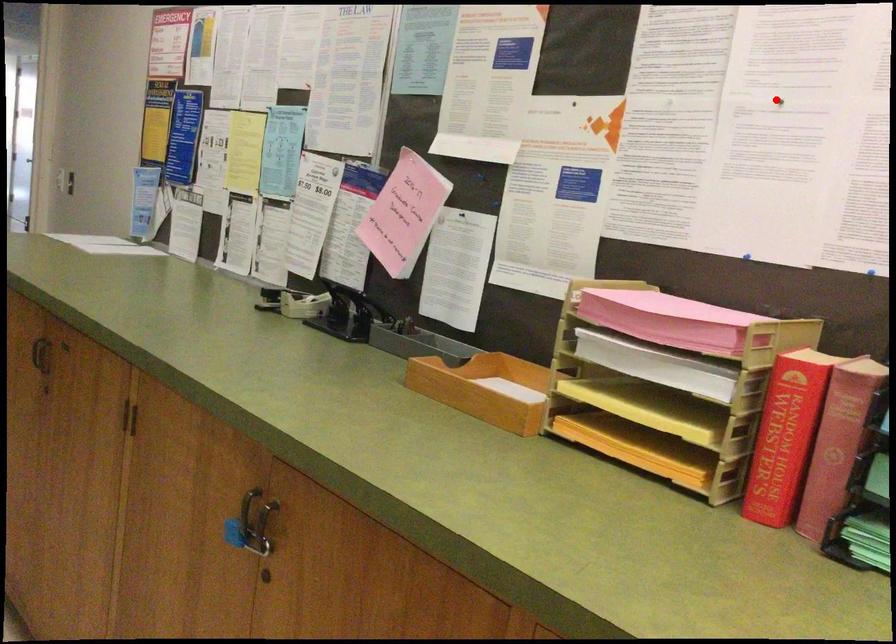
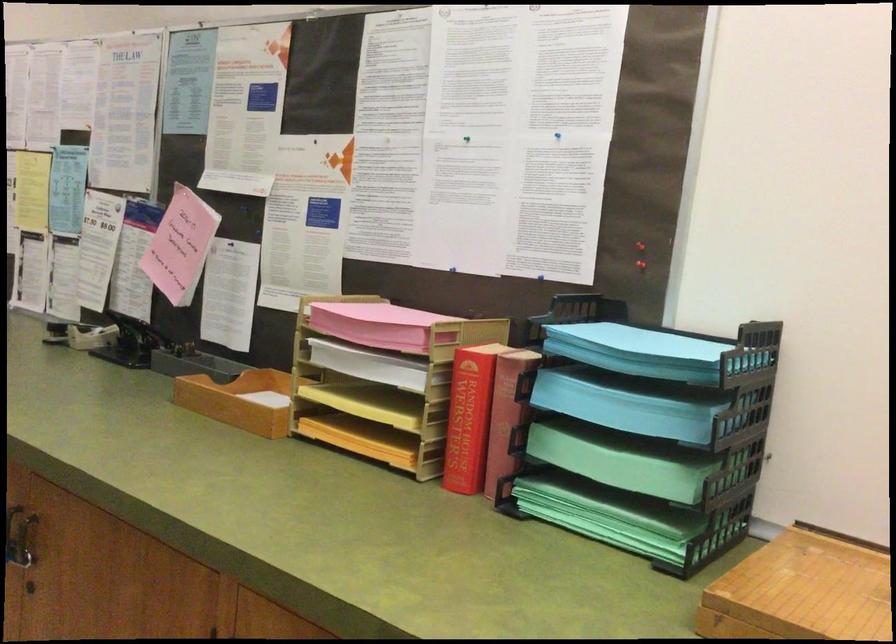
The point at the highlighted location is marked in the first image. Where is the corresponding point in the second image?

(467, 138)